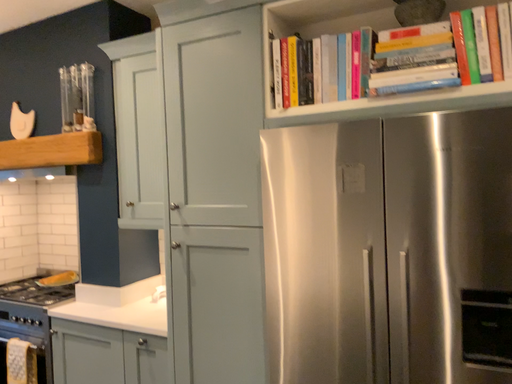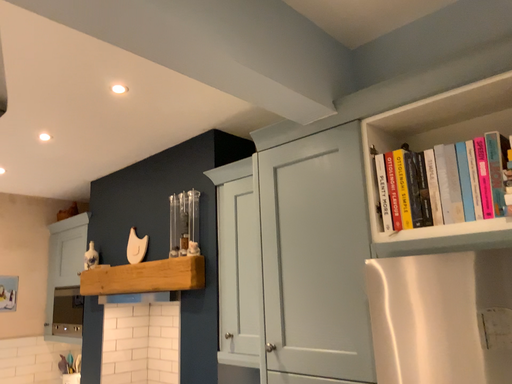
Question: How did the camera likely rotate when shooting the video?

Choices:
 (A) rotated left
 (B) rotated right

Answer: (A)